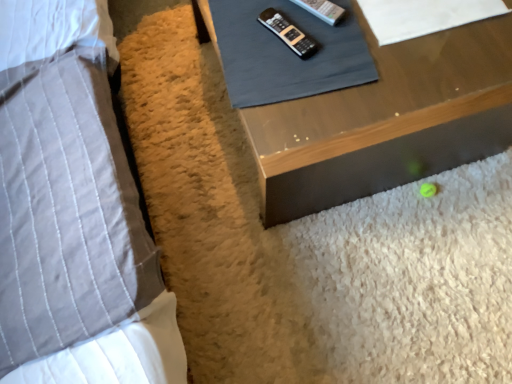
Describe the element at coordinates (73, 212) in the screenshot. I see `gray quilted pillow at left` at that location.

Image resolution: width=512 pixels, height=384 pixels. Identify the location of wooden table at lower right. (387, 120).

What do you see at coordinates (287, 53) in the screenshot? I see `gray fabric remote control at upper center, which is the first sheet from left to right` at bounding box center [287, 53].

Image resolution: width=512 pixels, height=384 pixels. Describe the element at coordinates (288, 33) in the screenshot. I see `black plastic remote at upper center` at that location.

The width and height of the screenshot is (512, 384). Describe the element at coordinates (424, 16) in the screenshot. I see `white paper at upper right, which is counted as the 1th sheet, starting from the right` at that location.

The image size is (512, 384). What are the coordinates of `gray quilted pillow at left` in the screenshot? It's located at (73, 212).

Does black plastic remote at upper center have a greater width compared to white paper at upper right, which is counted as the second sheet, starting from the left?

Incorrect, the width of black plastic remote at upper center does not surpass that of white paper at upper right, which is counted as the second sheet, starting from the left.

Considering the sizes of objects black plastic remote at upper center and white paper at upper right, which is counted as the 1th sheet, starting from the right, in the image provided, who is smaller, black plastic remote at upper center or white paper at upper right, which is counted as the 1th sheet, starting from the right,?

Smaller between the two is black plastic remote at upper center.

Are black plastic remote at upper center and white paper at upper right, which is counted as the 1th sheet, starting from the right, beside each other?

No, black plastic remote at upper center is not next to white paper at upper right, which is counted as the 1th sheet, starting from the right.

Which object is more forward, black plastic remote at upper center or white paper at upper right, which is counted as the second sheet, starting from the left?

black plastic remote at upper center.

Consider the image. Does white paper at upper right, which is counted as the second sheet, starting from the left, appear on the right side of wooden table at lower right?

Correct, you'll find white paper at upper right, which is counted as the second sheet, starting from the left, to the right of wooden table at lower right.

Can we say white paper at upper right, which is counted as the 1th sheet, starting from the right, lies outside wooden table at lower right?

No, white paper at upper right, which is counted as the 1th sheet, starting from the right, is not entirely external to wooden table at lower right.

Between white paper at upper right, which is counted as the 1th sheet, starting from the right, and wooden table at lower right, which one has less height?

Standing shorter between the two is white paper at upper right, which is counted as the 1th sheet, starting from the right.

From the image's perspective, is white paper at upper right, which is counted as the 1th sheet, starting from the right, above or below wooden table at lower right?

white paper at upper right, which is counted as the 1th sheet, starting from the right, is above wooden table at lower right.

From the image's perspective, is black plastic remote at upper center located above or below gray quilted pillow at left?

black plastic remote at upper center is situated higher than gray quilted pillow at left in the image.

Identify the location of control behind the gray quilted pillow at left. (288, 33).

In the image, is black plastic remote at upper center on the left side or the right side of gray quilted pillow at left?

From the image, it's evident that black plastic remote at upper center is to the right of gray quilted pillow at left.

From a real-world perspective, which object rests below the other?

wooden table at lower right, from a real-world perspective.

Is wooden table at lower right at the left side of gray quilted pillow at left?

No.

From the image's perspective, between wooden table at lower right and gray quilted pillow at left, who is located below?

gray quilted pillow at left is shown below in the image.

Is wooden table at lower right positioned with its back to gray quilted pillow at left?

That's not correct — wooden table at lower right is not looking away from gray quilted pillow at left.

Considering the positions of points (341, 56) and (389, 58), is point (341, 56) farther from camera compared to point (389, 58)?

No, it is in front of (389, 58).

Which object is positioned more to the right, gray fabric remote control at upper center, which is the first sheet from left to right, or wooden table at lower right?

From the viewer's perspective, wooden table at lower right appears more on the right side.

Where is `table located underneath the gray fabric remote control at upper center, which is the first sheet from left to right (from a real-world perspective)`? The width and height of the screenshot is (512, 384). table located underneath the gray fabric remote control at upper center, which is the first sheet from left to right (from a real-world perspective) is located at coordinates (387, 120).

Which of these two, gray fabric remote control at upper center, which is the first sheet from left to right, or wooden table at lower right, is smaller?

gray fabric remote control at upper center, which is the first sheet from left to right.

How different are the orientations of white paper at upper right, which is counted as the 1th sheet, starting from the right, and black plastic remote at upper center in degrees?

The angle between the facing direction of white paper at upper right, which is counted as the 1th sheet, starting from the right, and the facing direction of black plastic remote at upper center is 62.1 degrees.

Is white paper at upper right, which is counted as the second sheet, starting from the left, oriented towards black plastic remote at upper center?

No, white paper at upper right, which is counted as the second sheet, starting from the left, is not aimed at black plastic remote at upper center.

Considering the relative sizes of white paper at upper right, which is counted as the 1th sheet, starting from the right, and black plastic remote at upper center in the image provided, is white paper at upper right, which is counted as the 1th sheet, starting from the right, taller than black plastic remote at upper center?

Yes, white paper at upper right, which is counted as the 1th sheet, starting from the right, is taller than black plastic remote at upper center.

Would you consider white paper at upper right, which is counted as the 1th sheet, starting from the right, to be distant from black plastic remote at upper center?

Actually, white paper at upper right, which is counted as the 1th sheet, starting from the right, and black plastic remote at upper center are a little close together.

In the scene shown: Between gray fabric remote control at upper center, which is the first sheet from left to right, and gray quilted pillow at left, which one appears on the right side from the viewer's perspective?

From the viewer's perspective, gray fabric remote control at upper center, which is the first sheet from left to right, appears more on the right side.

How different are the orientations of gray fabric remote control at upper center, marked as the second sheet in a right-to-left arrangement, and gray quilted pillow at left in degrees?

3.58 degrees.

Can you confirm if gray fabric remote control at upper center, which is the first sheet from left to right, is thinner than gray quilted pillow at left?

Yes, gray fabric remote control at upper center, which is the first sheet from left to right, is thinner than gray quilted pillow at left.

Between point (310, 31) and point (30, 5), which one is positioned behind?

The point (30, 5) is farther from the camera.

Identify the location of sheet located behind the black plastic remote at upper center. click(x=424, y=16).

Where is `table on the left of the white paper at upper right, which is counted as the second sheet, starting from the left`? The width and height of the screenshot is (512, 384). table on the left of the white paper at upper right, which is counted as the second sheet, starting from the left is located at coordinates (387, 120).

From the picture: Based on their spatial positions, is gray fabric remote control at upper center, which is the first sheet from left to right, or black plastic remote at upper center further from white paper at upper right, which is counted as the 1th sheet, starting from the right?

black plastic remote at upper center is further to white paper at upper right, which is counted as the 1th sheet, starting from the right.

Based on their spatial positions, is black plastic remote at upper center or gray fabric remote control at upper center, which is the first sheet from left to right, further from gray quilted pillow at left?

Based on the image, black plastic remote at upper center appears to be further to gray quilted pillow at left.

Looking at the image, which one is located closer to wooden table at lower right, gray fabric remote control at upper center, which is the first sheet from left to right, or black plastic remote at upper center?

Among the two, gray fabric remote control at upper center, which is the first sheet from left to right, is located nearer to wooden table at lower right.

Estimate the real-world distances between objects in this image. Which object is closer to gray fabric remote control at upper center, marked as the second sheet in a right-to-left arrangement, black plastic remote at upper center or white paper at upper right, which is counted as the second sheet, starting from the left?

The object closer to gray fabric remote control at upper center, marked as the second sheet in a right-to-left arrangement, is black plastic remote at upper center.

When comparing their distances from gray quilted pillow at left, does black plastic remote at upper center or white paper at upper right, which is counted as the second sheet, starting from the left, seem further?

Based on the image, white paper at upper right, which is counted as the second sheet, starting from the left, appears to be further to gray quilted pillow at left.

Estimate the real-world distances between objects in this image. Which object is closer to white paper at upper right, which is counted as the second sheet, starting from the left, gray fabric remote control at upper center, marked as the second sheet in a right-to-left arrangement, or wooden table at lower right?

gray fabric remote control at upper center, marked as the second sheet in a right-to-left arrangement, is closer to white paper at upper right, which is counted as the second sheet, starting from the left.

Looking at the image, which one is located closer to white paper at upper right, which is counted as the second sheet, starting from the left, wooden table at lower right or gray quilted pillow at left?

wooden table at lower right is positioned closer to the anchor white paper at upper right, which is counted as the second sheet, starting from the left.

Estimate the real-world distances between objects in this image. Which object is further from gray quilted pillow at left, black plastic remote at upper center or wooden table at lower right?

The object further to gray quilted pillow at left is black plastic remote at upper center.

Where is `sheet between black plastic remote at upper center and white paper at upper right, which is counted as the 1th sheet, starting from the right, in the horizontal direction`? The image size is (512, 384). sheet between black plastic remote at upper center and white paper at upper right, which is counted as the 1th sheet, starting from the right, in the horizontal direction is located at coordinates click(287, 53).

Identify the location of table between gray quilted pillow at left and white paper at upper right, which is counted as the second sheet, starting from the left. This screenshot has height=384, width=512. (387, 120).

This screenshot has height=384, width=512. In order to click on sheet between gray quilted pillow at left and white paper at upper right, which is counted as the 1th sheet, starting from the right, from left to right in this screenshot , I will do `click(287, 53)`.

The image size is (512, 384). In order to click on control between gray quilted pillow at left and white paper at upper right, which is counted as the second sheet, starting from the left in this screenshot , I will do `click(288, 33)`.